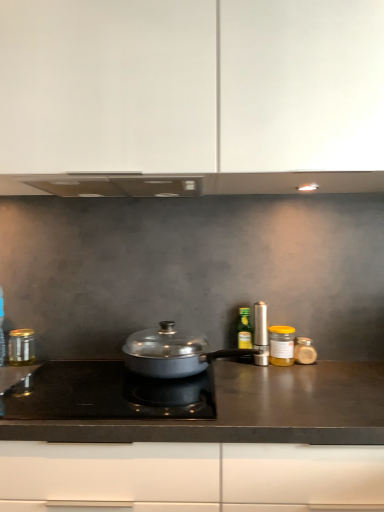
What are the coordinates of `vacant space situated above black glass cooktop at center (from a real-world perspective)` in the screenshot? It's located at (98, 385).